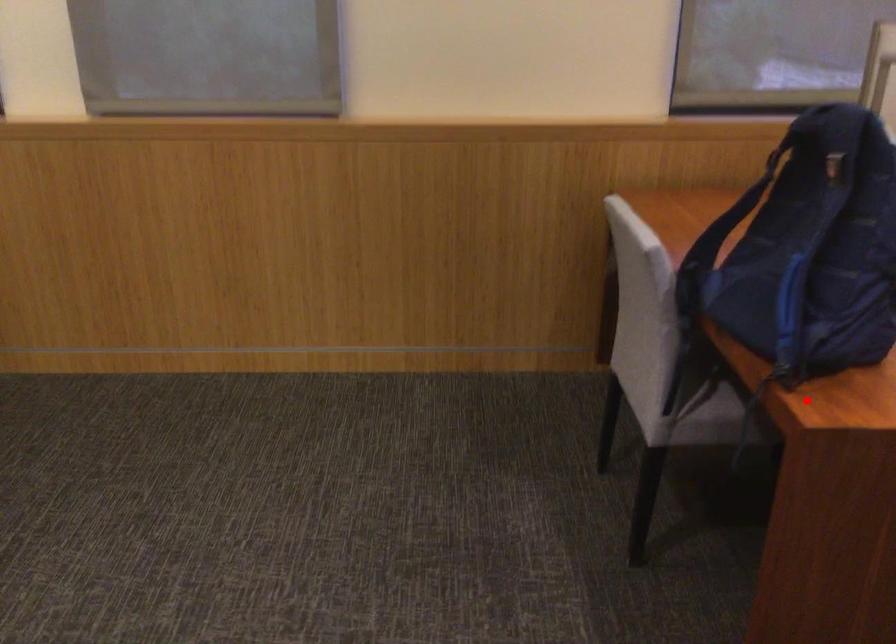
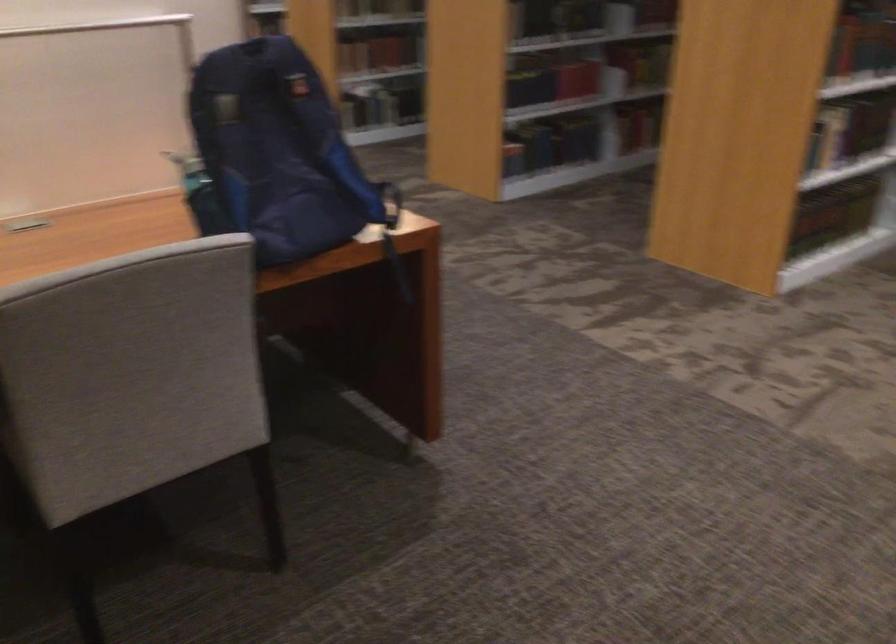
Question: I am providing you with two images of the same scene from different viewpoints. A red point is shown in image1. For the corresponding object point in image2, is it positioned nearer or farther from the camera?

Choices:
 (A) Nearer
 (B) Farther

Answer: (B)